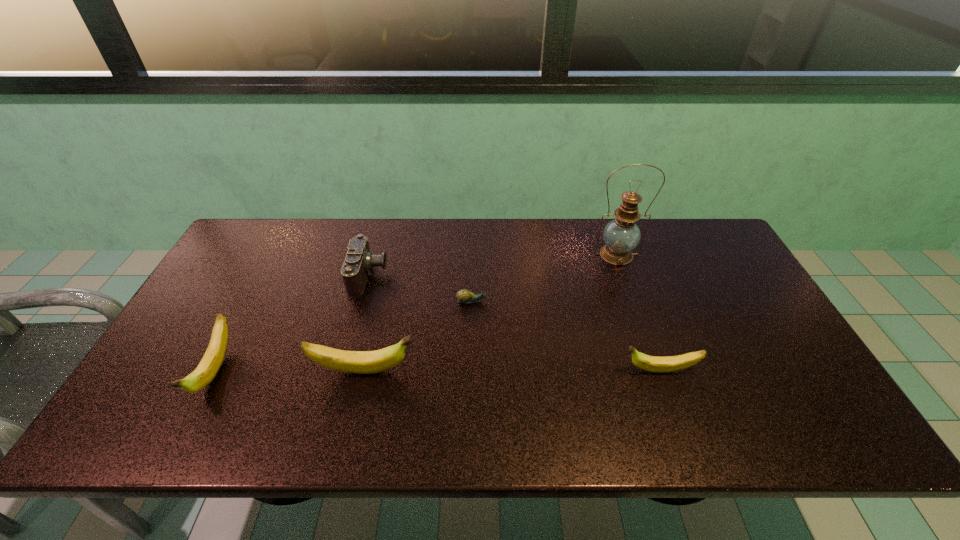
Identify the location of blank area in the image that satisfies the following two spatial constraints: 1. at the stem of the shortest banana; 2. at the stem of the second shortest banana. (660, 371).